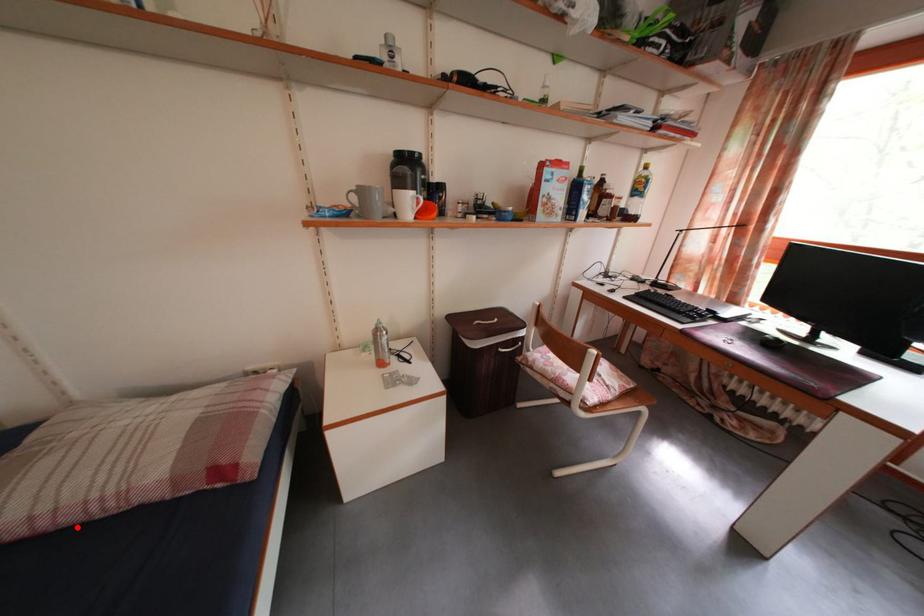
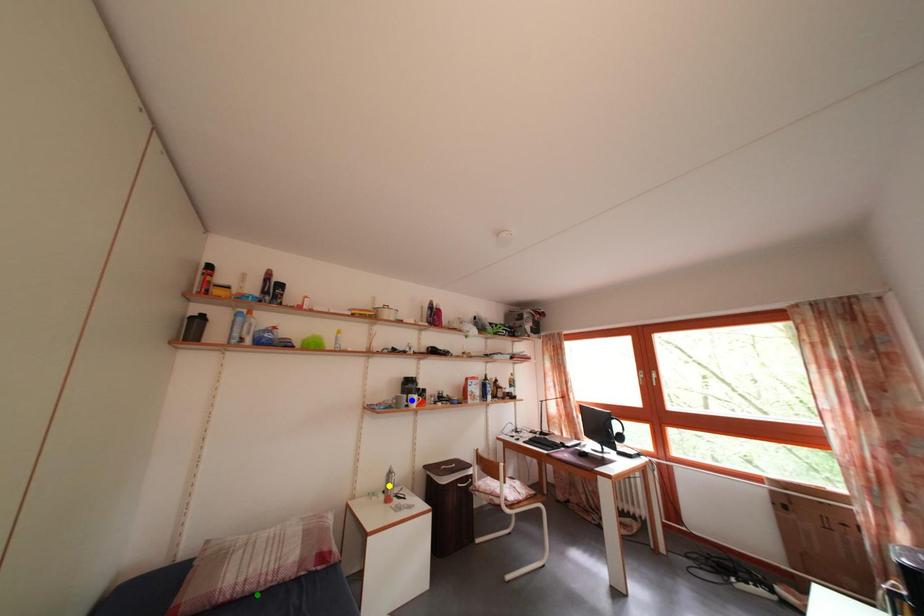
Question: I am providing you with two images of the same scene from different viewpoints. A red point is marked on the first image. You are given multiple points on the second image. Can you choose the point in image 2 that corresponds to the point in image 1?

Choices:
 (A) green point
 (B) yellow point
 (C) blue point

Answer: (A)